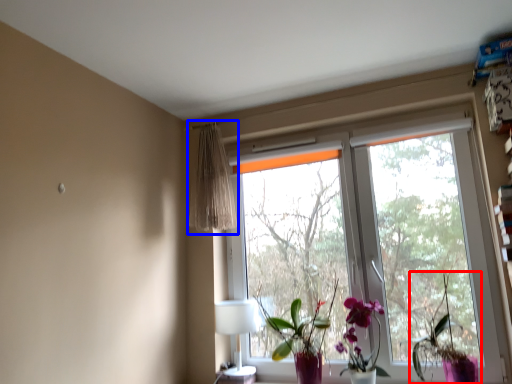
Question: Which of the following is the farthest to the observer, houseplant (highlighted by a red box) or curtain (highlighted by a blue box)?

Choices:
 (A) houseplant
 (B) curtain

Answer: (B)